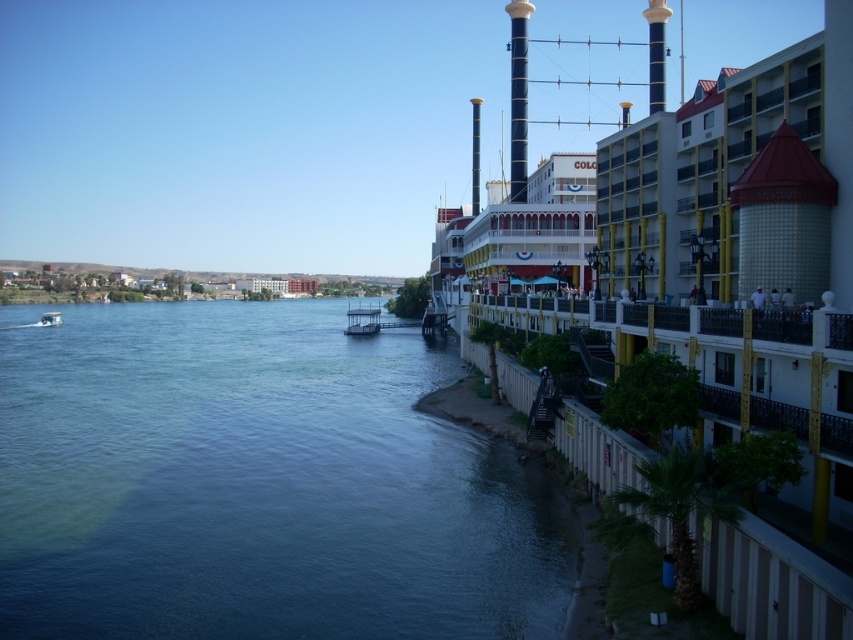
Question: Is white glossy boat at center in front of white plastic boat at lower left?

Choices:
 (A) yes
 (B) no

Answer: (A)

Question: Is blue water at lower left in front of white plastic boat at lower left?

Choices:
 (A) yes
 (B) no

Answer: (A)

Question: Is the position of white glossy boat at center more distant than that of white plastic boat at lower left?

Choices:
 (A) no
 (B) yes

Answer: (A)

Question: Based on their relative distances, which object is nearer to the blue water at lower left?

Choices:
 (A) white glossy boat at center
 (B) white plastic boat at lower left

Answer: (A)

Question: Estimate the real-world distances between objects in this image. Which object is farther from the blue water at lower left?

Choices:
 (A) white plastic boat at lower left
 (B) white glossy boat at center

Answer: (A)

Question: Based on their relative distances, which object is farther from the white glossy boat at center?

Choices:
 (A) white plastic boat at lower left
 (B) blue water at lower left

Answer: (A)